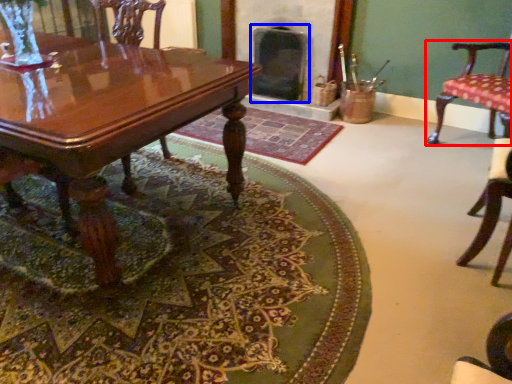
Question: Which object appears farthest to the camera in this image, chair (highlighted by a red box) or fireplace (highlighted by a blue box)?

Choices:
 (A) chair
 (B) fireplace

Answer: (B)